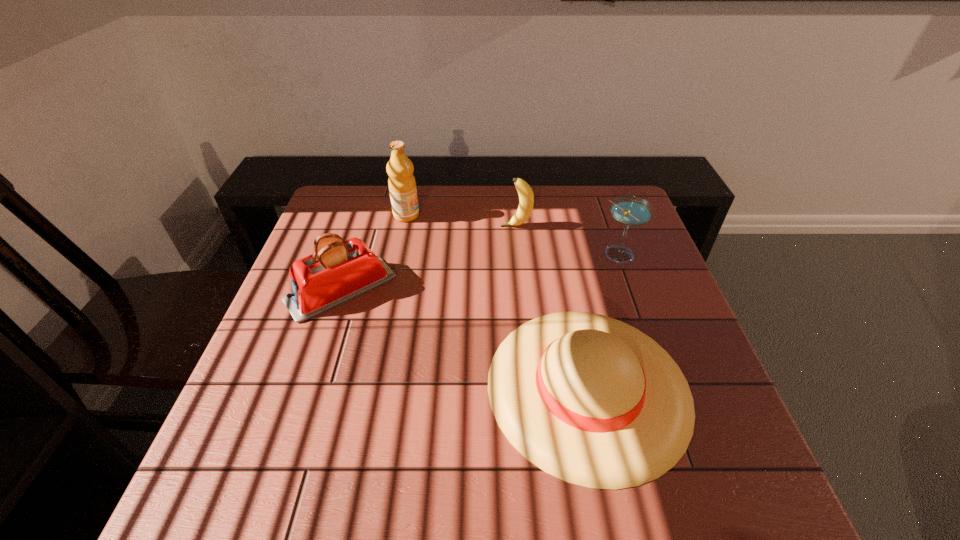
I want to click on free location that satisfies the following two spatial constraints: 1. on the back side of the martini; 2. from the stem of the banana, so click(609, 226).

Where is `free location that satisfies the following two spatial constraints: 1. on the front side of the shortest object; 2. on the right side of the toaster`? This screenshot has height=540, width=960. free location that satisfies the following two spatial constraints: 1. on the front side of the shortest object; 2. on the right side of the toaster is located at coordinates (309, 387).

Identify the location of vacant area that satisfies the following two spatial constraints: 1. on the back side of the shortest object; 2. on the left side of the martini. The image size is (960, 540). (561, 255).

You are a GUI agent. You are given a task and a screenshot of the screen. Output one action in this format:
    pyautogui.click(x=<x>, y=<y>)
    Task: Click on the vacant area in the image that satisfies the following two spatial constraints: 1. on the front label of the martini; 2. on the left side of the tallest object
    
    Given the screenshot: What is the action you would take?
    pyautogui.click(x=398, y=255)

This screenshot has width=960, height=540. Identify the location of free spot that satisfies the following two spatial constraints: 1. from the stem of the banana; 2. on the left side of the sombrero. (532, 387).